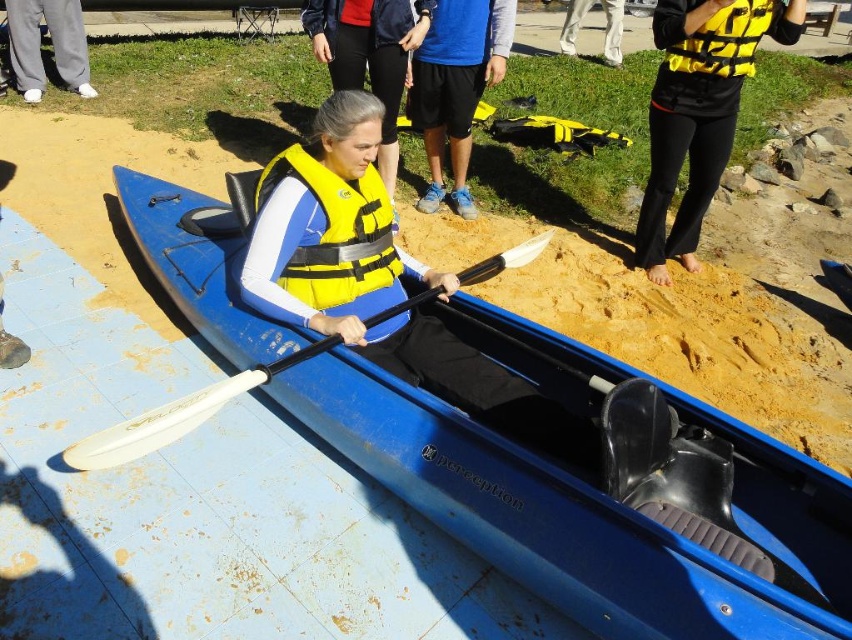
Question: Which object appears farthest from the camera in this image?

Choices:
 (A) yellow matte life jacket at upper center
 (B) yellow/black life vest at upper right
 (C) gray cotton pants at upper left
 (D) blue synthetic shorts at center

Answer: (C)

Question: Does yellow/black life vest at upper right lie in front of yellow life vest at center?

Choices:
 (A) yes
 (B) no

Answer: (A)

Question: Can you confirm if blue plastic kayak at center is positioned above blue synthetic shorts at center?

Choices:
 (A) yes
 (B) no

Answer: (B)

Question: Can you confirm if blue synthetic shorts at center is smaller than white plastic paddle at center?

Choices:
 (A) yes
 (B) no

Answer: (A)

Question: Which object is positioned farthest from the blue plastic kayak at center?

Choices:
 (A) yellow life vest at center
 (B) yellow/black life vest at upper right
 (C) gray cotton pants at upper left

Answer: (C)

Question: Based on their relative distances, which object is farther from the blue synthetic shorts at center?

Choices:
 (A) blue plastic kayak at center
 (B) yellow matte life jacket at upper center
 (C) yellow life vest at center

Answer: (A)